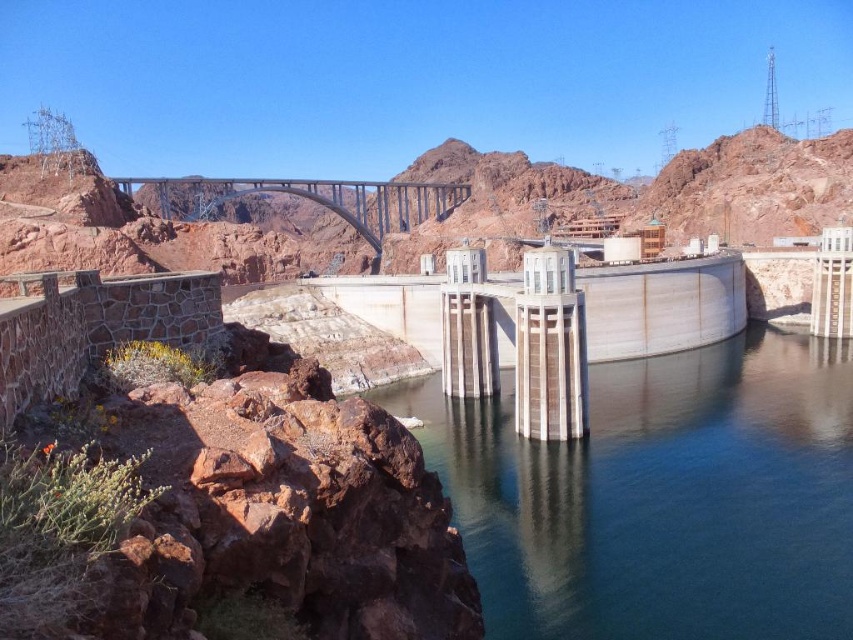
Question: Which of the following is the farthest from the observer?

Choices:
 (A) (352, 202)
 (B) (491, 490)

Answer: (A)

Question: Is clear blue water at center to the left of metallic gray bridge at center from the viewer's perspective?

Choices:
 (A) no
 (B) yes

Answer: (A)

Question: Does clear blue water at center have a smaller size compared to metallic gray bridge at center?

Choices:
 (A) yes
 (B) no

Answer: (A)

Question: Does clear blue water at center lie in front of metallic gray bridge at center?

Choices:
 (A) yes
 (B) no

Answer: (A)

Question: Among these points, which one is nearest to the camera?

Choices:
 (A) (143, 182)
 (B) (607, 557)

Answer: (B)